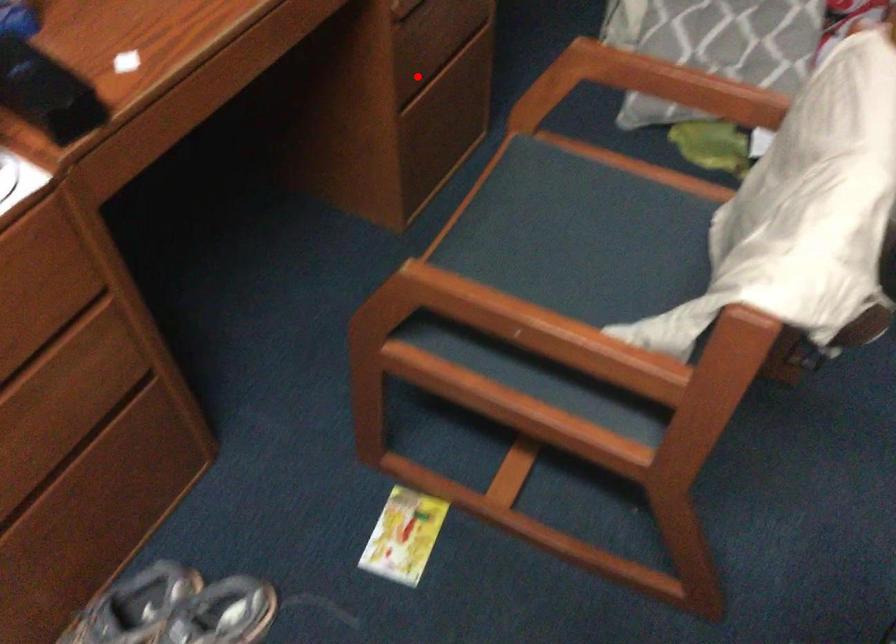
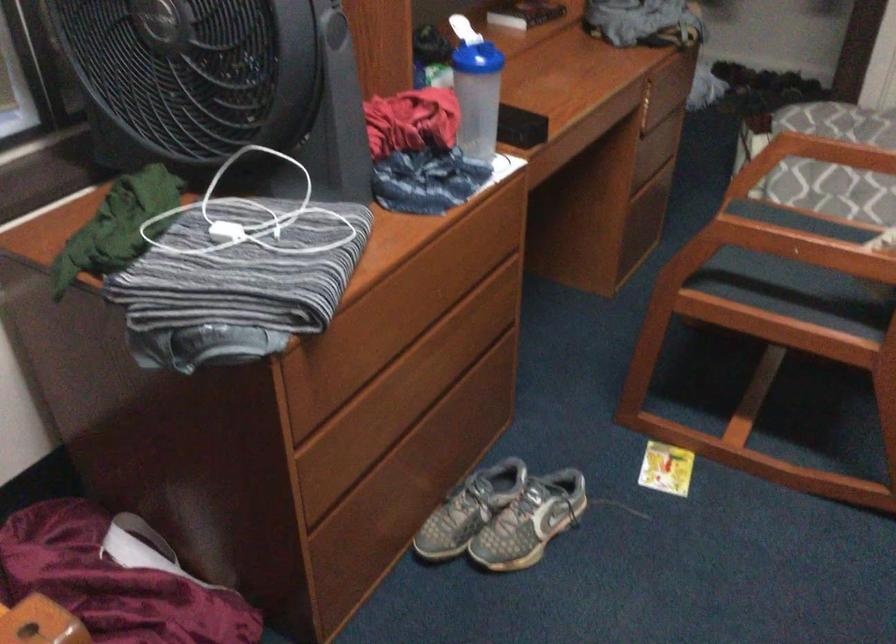
Question: I am providing you with two images of the same scene from different viewpoints. Given a red point in image1, look at the same physical point in image2. Is it:

Choices:
 (A) Closer to the viewpoint
 (B) Farther from the viewpoint

Answer: (B)